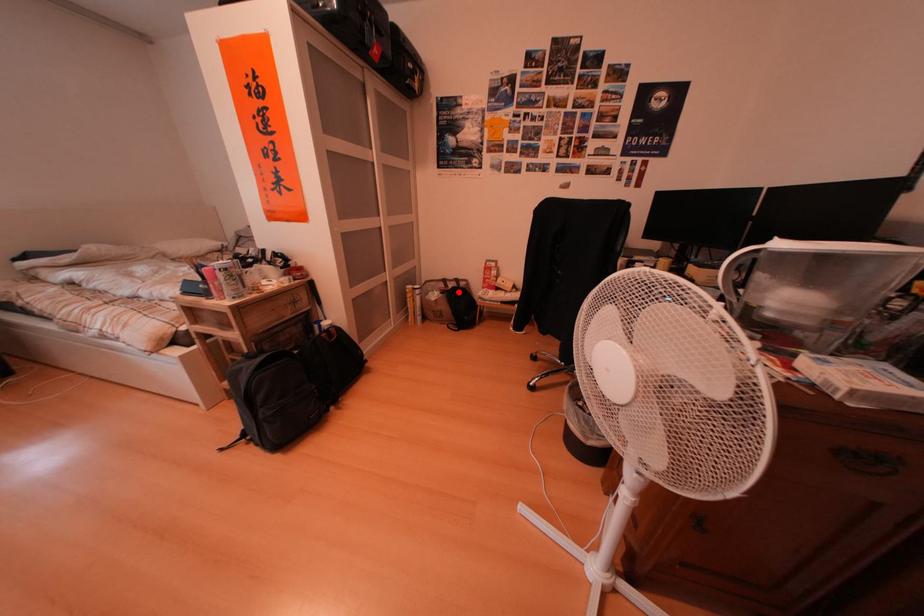
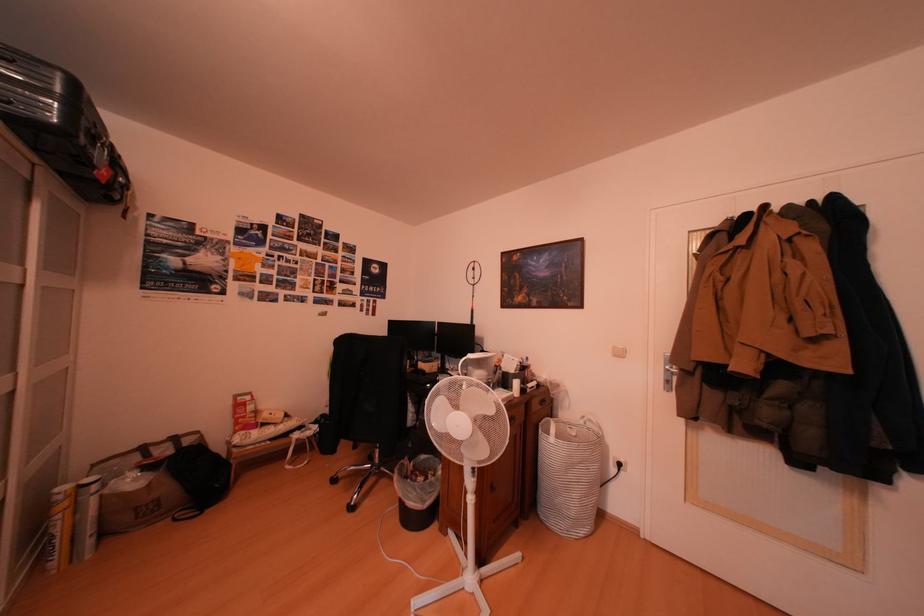
The point at the highlighted location is marked in the first image. Where is the corresponding point in the second image?

(161, 461)